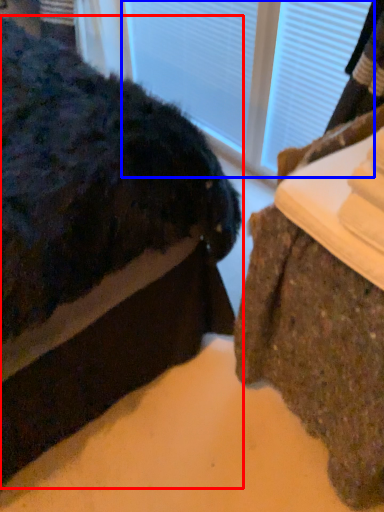
Question: Which point is further to the camera, furniture (highlighted by a red box) or glass door (highlighted by a blue box)?

Choices:
 (A) furniture
 (B) glass door

Answer: (B)